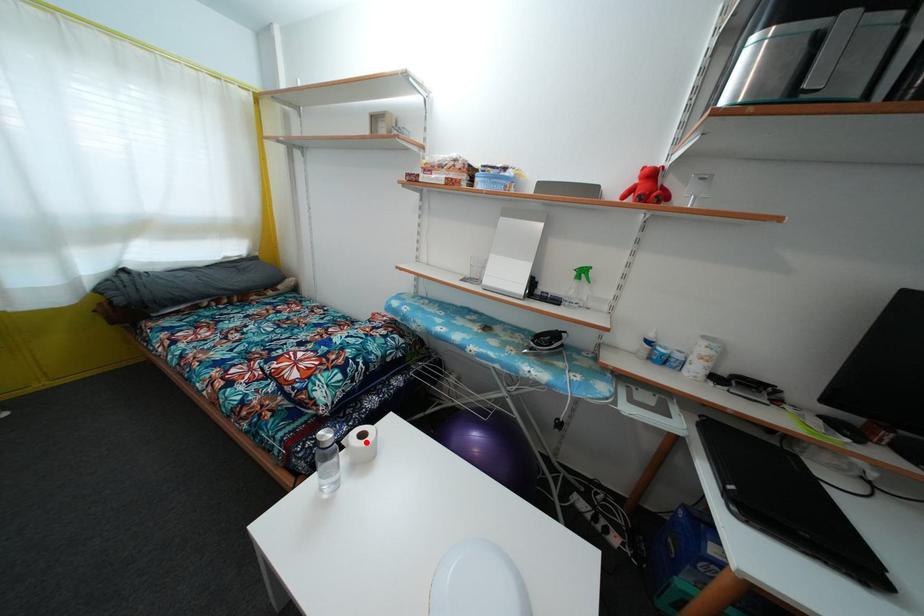
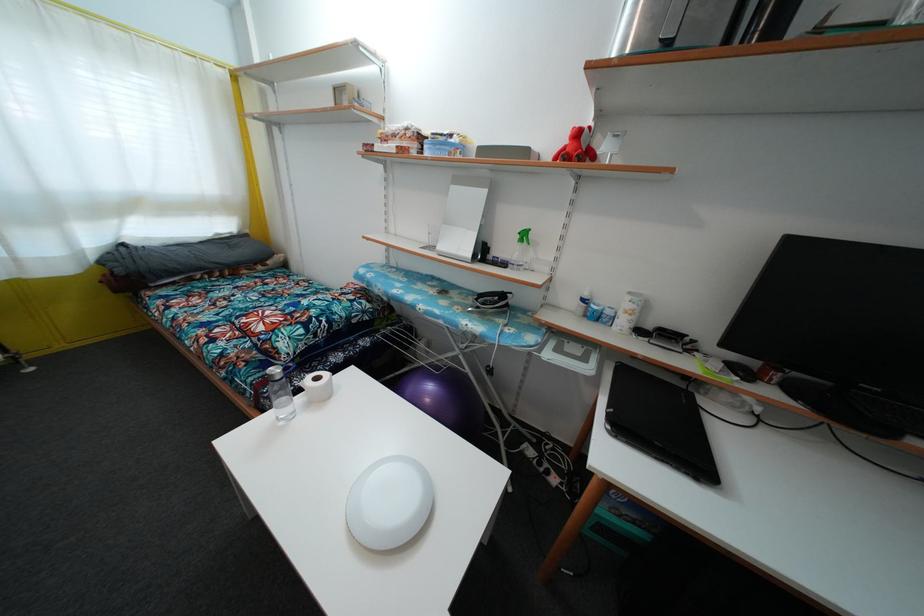
The point at the highlighted location is marked in the first image. Where is the corresponding point in the second image?

(321, 386)